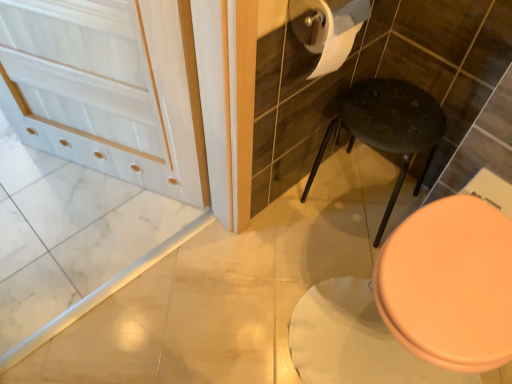
Locate an element on the screen. free point in front of white matte screen door at upper left is located at coordinates (82, 242).